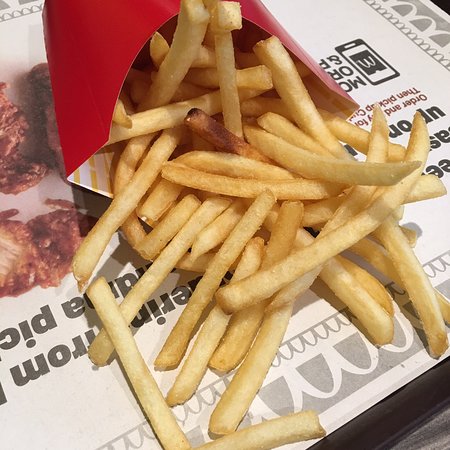
Find the location of a particular element. table is located at coordinates (405, 401).